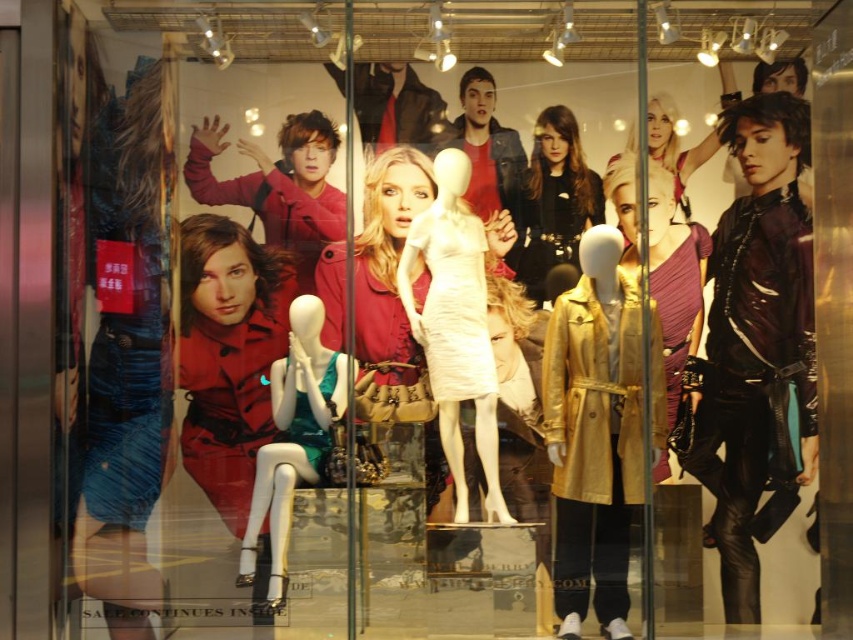
You are a customer standing in front of the fashion store window. You want to know if you can reach the shiny black leather jacket at right to touch it. The store has a policy that customers must stay at least 1.8 meters away from the window displays. Can you safely reach the jacket without violating the store policy?

The shiny black leather jacket at right is 2.16 meters away from the viewer. Since the store requires customers to stay at least 1.8 meters away, you are already beyond the minimum distance and cannot reach the jacket without moving closer, which would violate the policy.

You are a customer trying to decide between two outfits displayed in the store window. You see the white matte dress at center and the matte gold coat at upper right. Which outfit takes up more horizontal space in the display?

The matte gold coat at upper right takes up more horizontal space than the white matte dress at center because the white matte dress at center has a lesser width compared to matte gold coat at upper right.